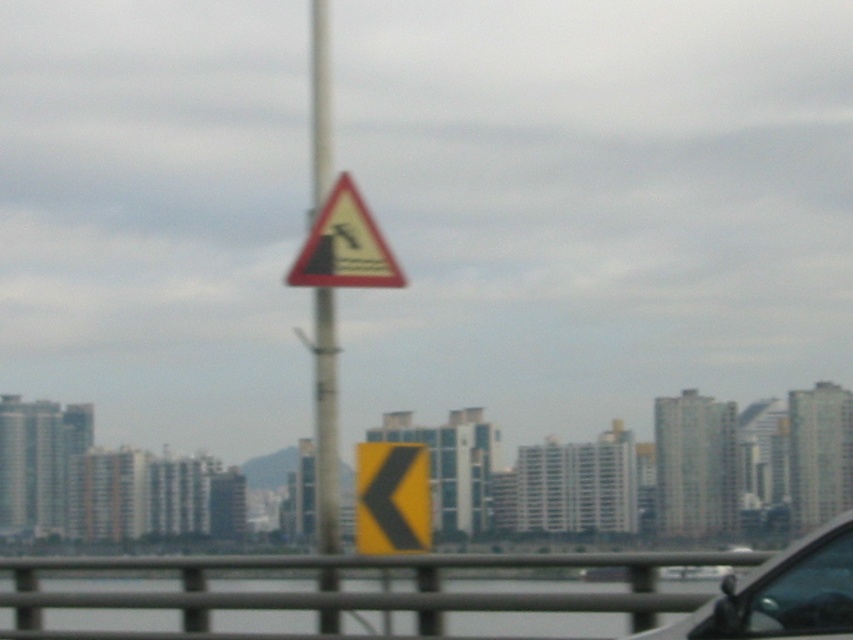
Consider the image. Which is more to the left, metallic gray car at lower right or yellow matte arrow at center?

yellow matte arrow at center is more to the left.

Can you confirm if metallic gray car at lower right is positioned to the left of yellow matte arrow at center?

No, metallic gray car at lower right is not to the left of yellow matte arrow at center.

What do you see at coordinates (781, 595) in the screenshot? I see `metallic gray car at lower right` at bounding box center [781, 595].

Image resolution: width=853 pixels, height=640 pixels. In order to click on metallic gray car at lower right in this screenshot , I will do `click(781, 595)`.

Does metallic gray car at lower right have a greater height compared to yellow triangular warning sign at center?

No.

Consider the image. Can you confirm if metallic gray car at lower right is wider than yellow triangular warning sign at center?

Correct, the width of metallic gray car at lower right exceeds that of yellow triangular warning sign at center.

Find the location of `metallic gray car at lower right`. metallic gray car at lower right is located at coordinates (781, 595).

In the scene shown: Who is more forward, (428, 472) or (325, 280)?

Point (428, 472) is in front.

Between yellow matte arrow at center and yellow triangular warning sign at center, which one is positioned higher?

Positioned higher is yellow triangular warning sign at center.

Is point (368, 476) more distant than point (372, 262)?

No, it is not.

Where is `yellow matte arrow at center`? The height and width of the screenshot is (640, 853). yellow matte arrow at center is located at coordinates (392, 497).